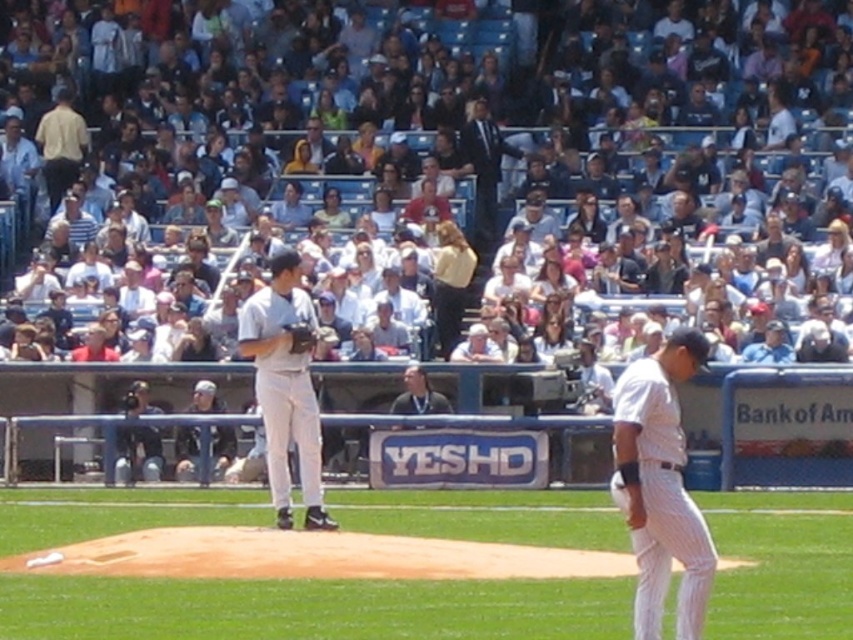
You are a drone operator trying to capture a shot of the green grass field at center and the white cotton crowd at upper center. Which object should you focus on first if you want to film them in order from closest to farthest?

You should focus on the white cotton crowd at upper center first because it is closer to you than the green grass field at center, so filming from closest to farthest would start with the white cotton crowd at upper center.

Looking at the baseball game scene, where is the green grass field at center in relation to the dark gray shirt at center?

The green grass field at center is to the right of the dark gray shirt at center.

You are a photographer at the baseball game and want to capture a photo where the green grass field at center is visible behind the white pinstriped uniform at center. Is this possible given their positions?

The green grass field at center is below the white pinstriped uniform at center, so it is possible to capture the green grass field at center behind the white pinstriped uniform at center in the photo.